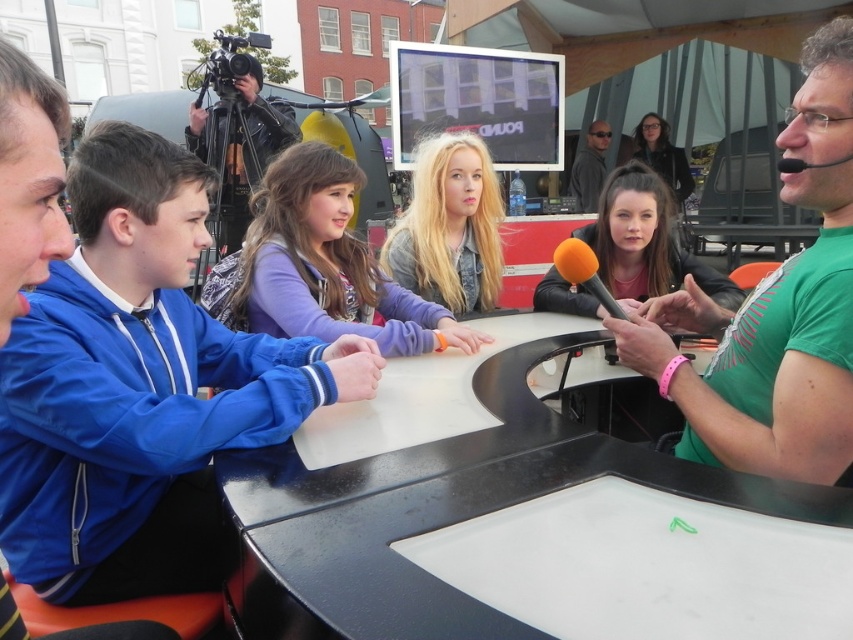
You are organizing a group activity for children and need to ensure they are spaced at least 2 feet apart for safety. The blue fabric jacket at left and purple fabric shirt at center are two participants in the group. Based on the image, are these two participants meeting the required distance?

The blue fabric jacket at left and purple fabric shirt at center are 25.40 inches apart from each other. Since 25.40 inches is equal to 2.11 feet, which is more than the required 2 feet, the participants are meeting the distance requirement.